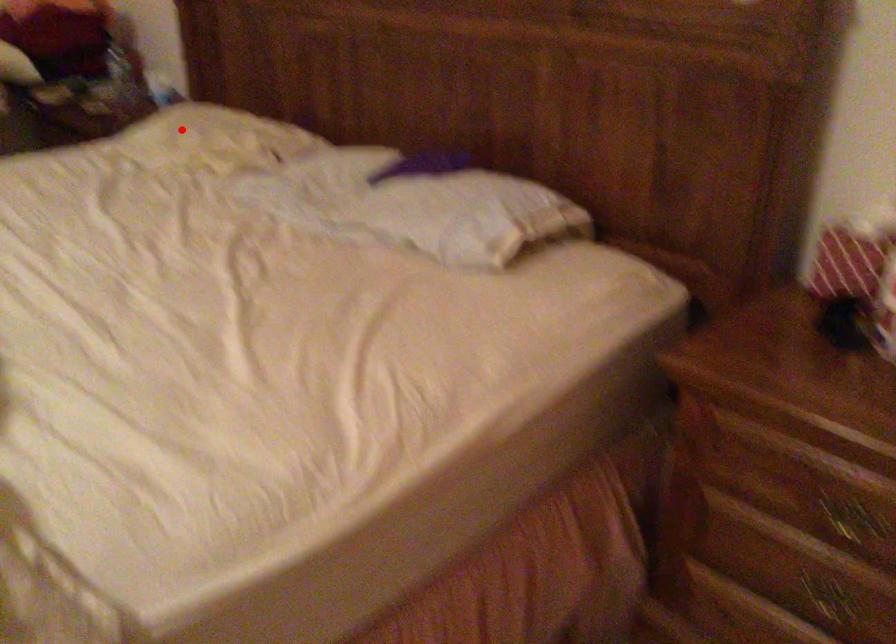
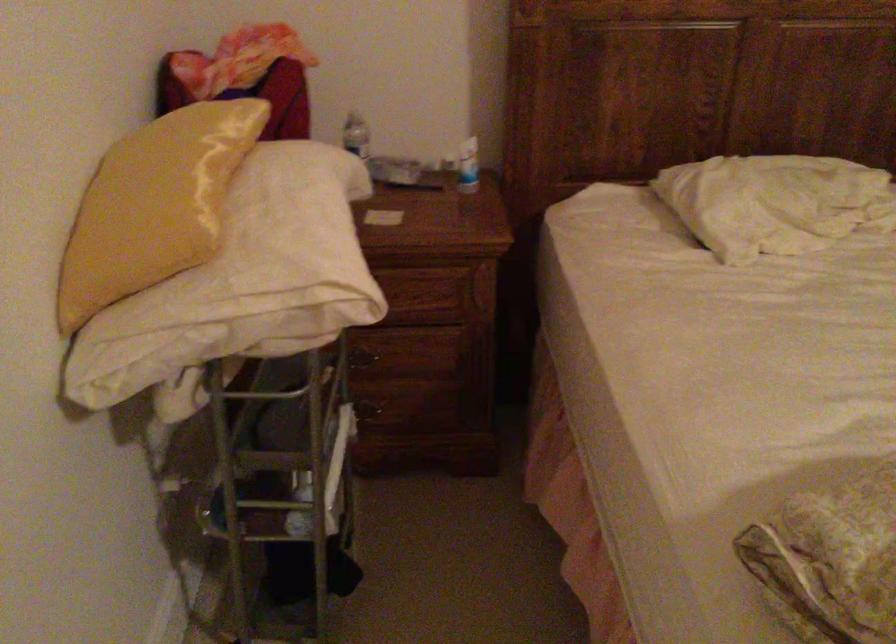
Question: I am providing you with two images of the same scene from different viewpoints. A red point is shown in image1. For the corresponding object point in image2, is it positioned nearer or farther from the camera?

Choices:
 (A) Nearer
 (B) Farther

Answer: (A)